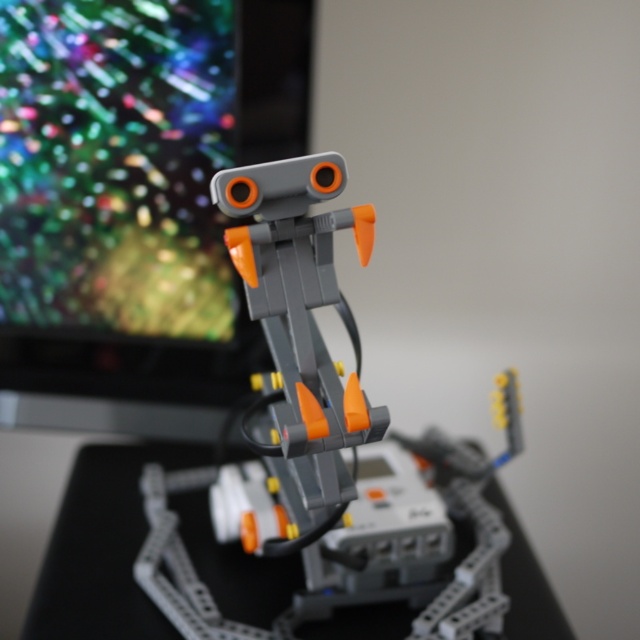
Does matte plastic robot at center have a greater width compared to gray plastic table at center?

Incorrect, matte plastic robot at center's width does not surpass gray plastic table at center's.

Can you confirm if matte plastic robot at center is smaller than gray plastic table at center?

Correct, matte plastic robot at center occupies less space than gray plastic table at center.

Between point (305, 390) and point (26, 451), which one is positioned behind?

The point (26, 451) is more distant.

Locate an element on the screen. The height and width of the screenshot is (640, 640). matte plastic robot at center is located at coordinates (301, 323).